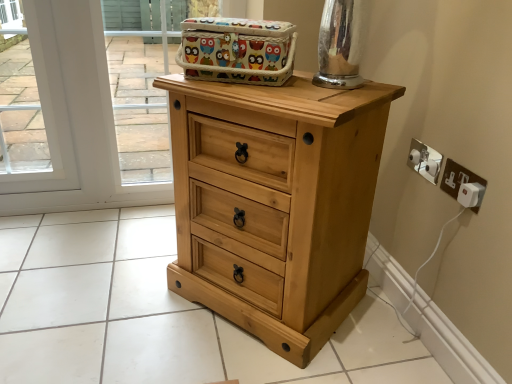
Question: From the image's perspective, is colorful fabric basket at upper center located above or below white plastic plug at lower right, the 1th electric outlet positioned from the front?

Choices:
 (A) above
 (B) below

Answer: (A)

Question: Is colorful fabric basket at upper center taller or shorter than white plastic plug at lower right, marked as the second electric outlet in a back-to-front arrangement?

Choices:
 (A) tall
 (B) short

Answer: (A)

Question: Which is farther from the wooden basket at upper center?

Choices:
 (A) natural wood chest of drawers at center
 (B) white plastic electric outlet at right, positioned as the 1th electric outlet in back-to-front order
 (C) white plastic plug at lower right, marked as the second electric outlet in a back-to-front arrangement
 (D) colorful fabric basket at upper center

Answer: (C)

Question: Which object is the farthest from the white plastic plug at lower right, the 1th electric outlet positioned from the front?

Choices:
 (A) white plastic electric outlet at right, which is the 2th electric outlet from front to back
 (B) natural wood chest of drawers at center
 (C) colorful fabric basket at upper center
 (D) wooden basket at upper center

Answer: (D)